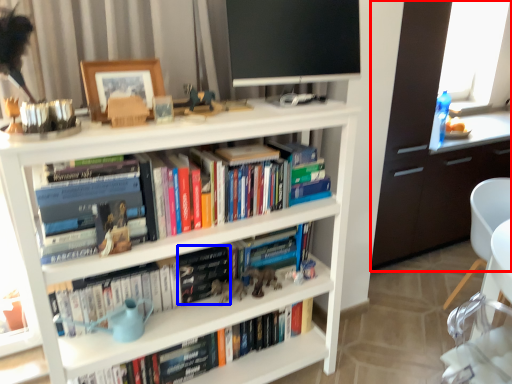
Question: Among these objects, which one is nearest to the camera, cabinetry (highlighted by a red box) or paperback book (highlighted by a blue box)?

Choices:
 (A) cabinetry
 (B) paperback book

Answer: (B)